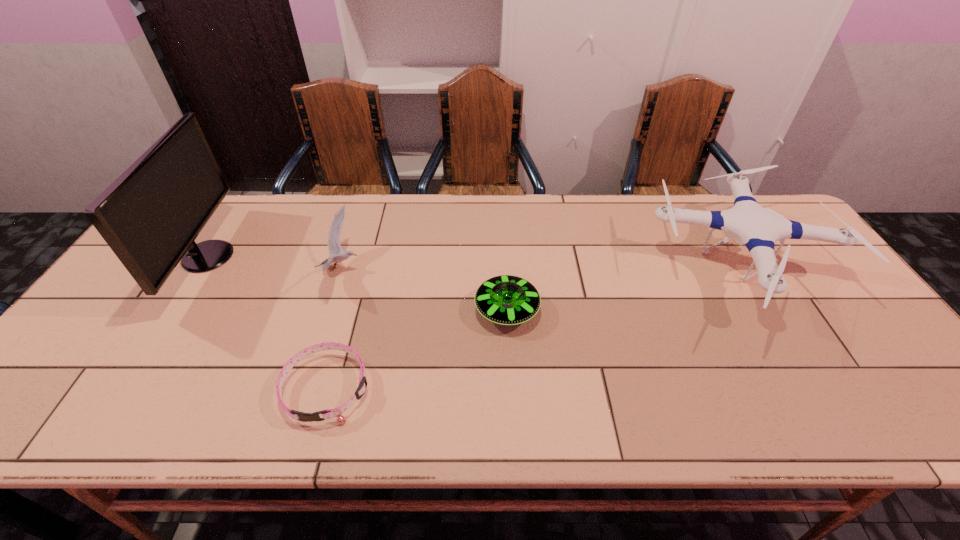
At what (x,y) coordinates should I click in order to perform the action: click on the leftmost object. Please return your answer as a coordinate pair (x, y). The height and width of the screenshot is (540, 960). Looking at the image, I should click on pos(151,214).

Find the location of a particular element. The image size is (960, 540). computer monitor is located at coordinates (151, 214).

Image resolution: width=960 pixels, height=540 pixels. Identify the location of drone. click(x=748, y=223).

I want to click on the second tallest object, so pos(748,223).

At what (x,y) coordinates should I click in order to perform the action: click on gull. Please return your answer as a coordinate pair (x, y). This screenshot has width=960, height=540. Looking at the image, I should click on (334, 247).

The height and width of the screenshot is (540, 960). In order to click on saucer in this screenshot , I will do [508, 300].

This screenshot has height=540, width=960. I want to click on the fourth object from left to right, so click(508, 300).

Where is `the nearest object`? The width and height of the screenshot is (960, 540). the nearest object is located at coordinates (337, 412).

Find the location of `dog collar`. dog collar is located at coordinates (337, 412).

At what (x,y) coordinates should I click in order to perform the action: click on vacant space located on the front-facing side of the tallest object. Please return your answer as a coordinate pair (x, y). The height and width of the screenshot is (540, 960). Looking at the image, I should click on (301, 256).